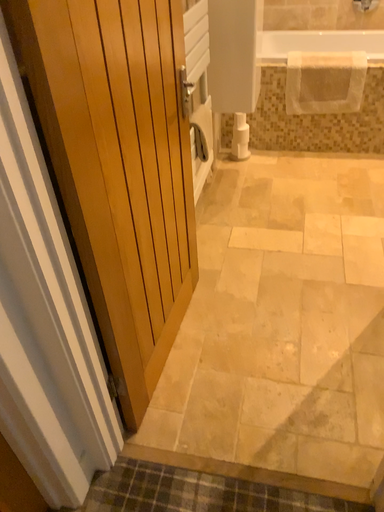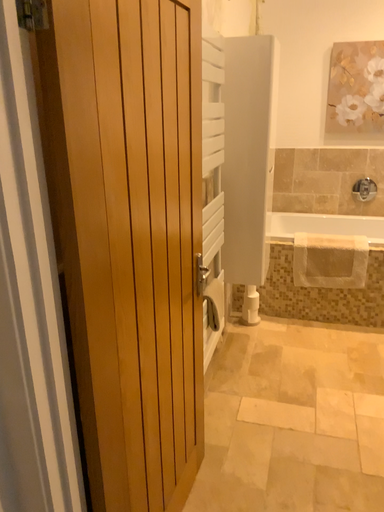
Question: Which way did the camera rotate in the video?

Choices:
 (A) rotated downward
 (B) rotated upward

Answer: (B)